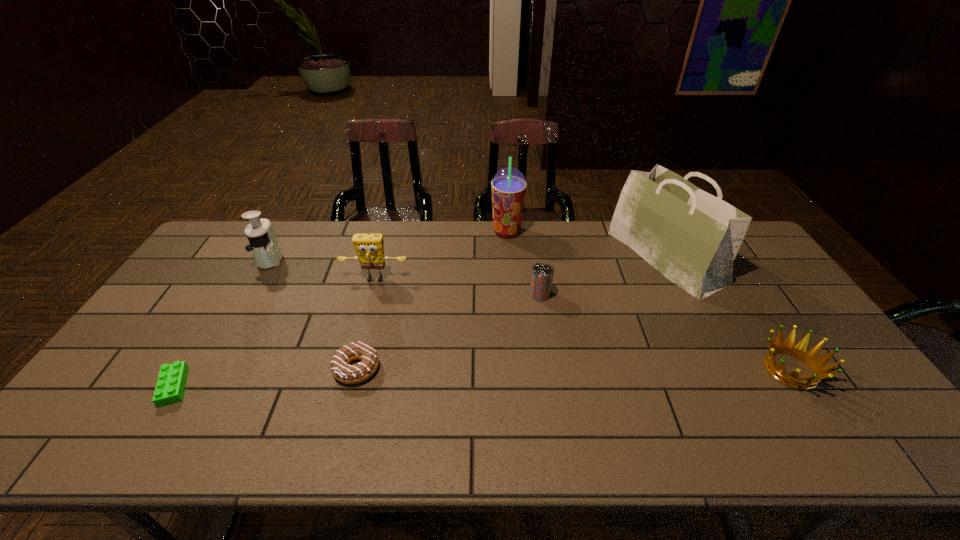
At what (x,y) coordinates should I click in order to perform the action: click on grocery bag. Please return your answer as a coordinate pair (x, y). Looking at the image, I should click on (691, 237).

Image resolution: width=960 pixels, height=540 pixels. In order to click on smoothie in this screenshot , I will do `click(508, 186)`.

Find the location of a particular element. juicer is located at coordinates (264, 245).

The image size is (960, 540). In order to click on sponge in this screenshot , I will do `click(369, 247)`.

Where is `the fifth tallest object`? The image size is (960, 540). the fifth tallest object is located at coordinates (542, 273).

The height and width of the screenshot is (540, 960). In order to click on crown in this screenshot , I will do `click(817, 365)`.

At what (x,y) coordinates should I click in order to perform the action: click on doughnut. Please return your answer as a coordinate pair (x, y). Looking at the image, I should click on (349, 374).

Where is `the shortest object`? This screenshot has height=540, width=960. the shortest object is located at coordinates (170, 386).

Where is `blank space located 0.080m on the front of the grocery bag`? blank space located 0.080m on the front of the grocery bag is located at coordinates (698, 320).

This screenshot has width=960, height=540. In order to click on free space located on the left of the smoothie in this screenshot , I will do `click(473, 232)`.